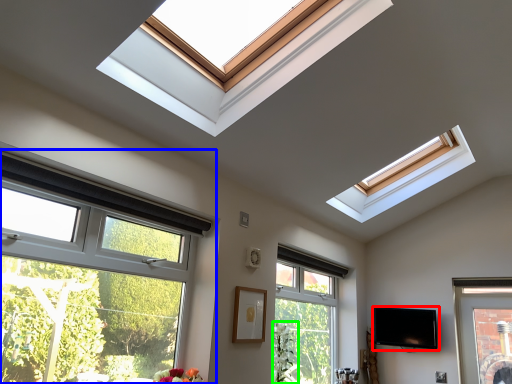
Question: Which object is the closest to the television (highlighted by a red box)? Choose among these: window (highlighted by a blue box) or plant (highlighted by a green box).

Choices:
 (A) window
 (B) plant

Answer: (B)